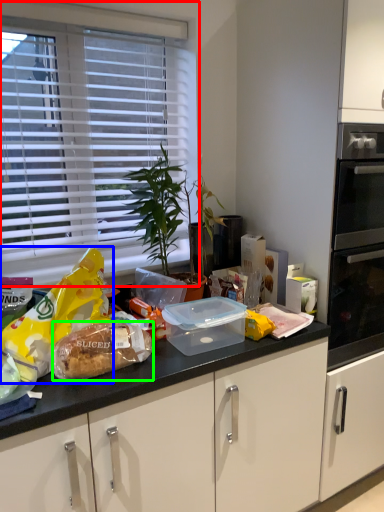
Question: Which object is the closest to the window blind (highlighted by a red box)? Choose among these: snack (highlighted by a blue box) or food (highlighted by a green box).

Choices:
 (A) snack
 (B) food

Answer: (A)